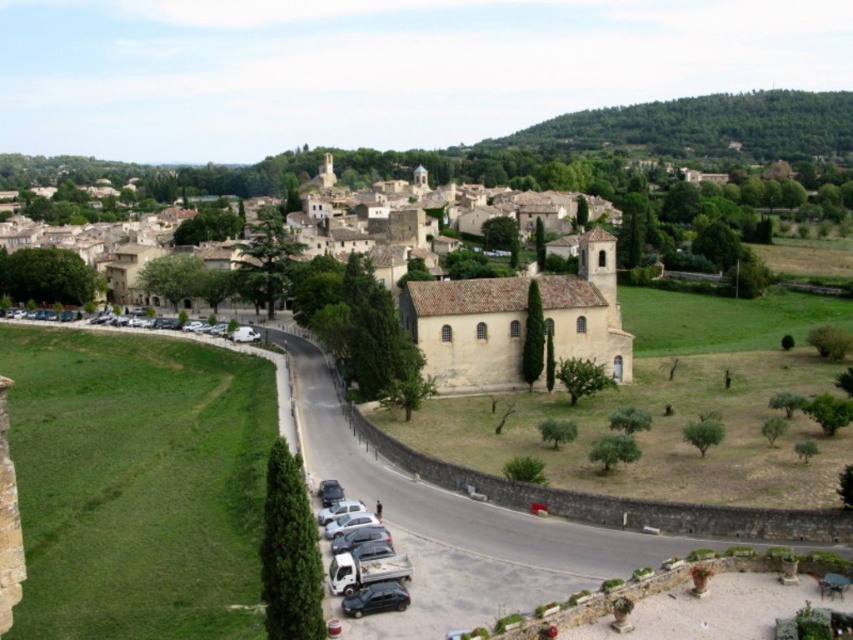
Question: Which object is closer to the camera taking this photo?

Choices:
 (A) yellow stone church at center
 (B) green leafy hillside at upper right
 (C) metallic silver truck at lower center

Answer: (C)

Question: Does green leafy hillside at upper right have a lesser width compared to metallic silver truck at lower center?

Choices:
 (A) no
 (B) yes

Answer: (A)

Question: Is yellow stone church at center wider than green leafy hillside at upper right?

Choices:
 (A) no
 (B) yes

Answer: (A)

Question: Which of the following is the farthest from the observer?

Choices:
 (A) (339, 556)
 (B) (582, 145)

Answer: (B)

Question: Which point appears closest to the camera in this image?

Choices:
 (A) (351, 554)
 (B) (808, 97)
 (C) (422, 236)

Answer: (A)

Question: Does yellow stone church at center appear under green leafy hillside at upper right?

Choices:
 (A) no
 (B) yes

Answer: (B)